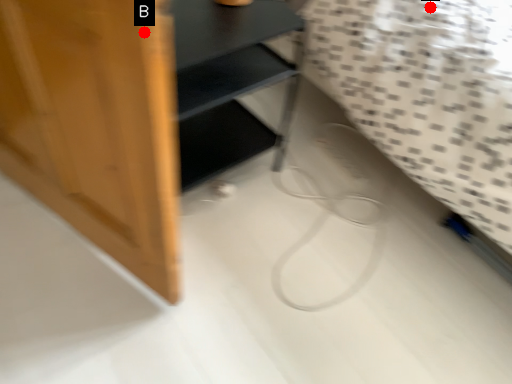
Question: Two points are circled on the image, labeled by A and B beside each circle. Which point is farther from the camera taking this photo?

Choices:
 (A) A is further
 (B) B is further

Answer: (A)